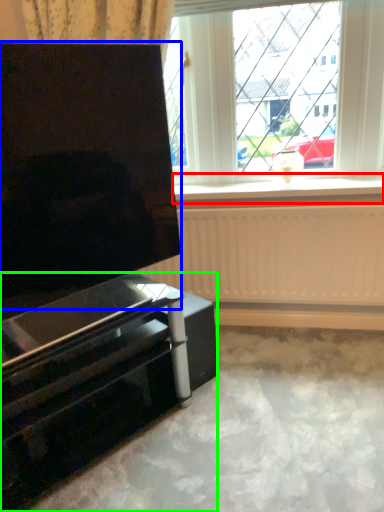
Question: Which is nearer to the window sill (highlighted by a red box)? screen (highlighted by a blue box) or furniture (highlighted by a green box).

Choices:
 (A) screen
 (B) furniture

Answer: (A)